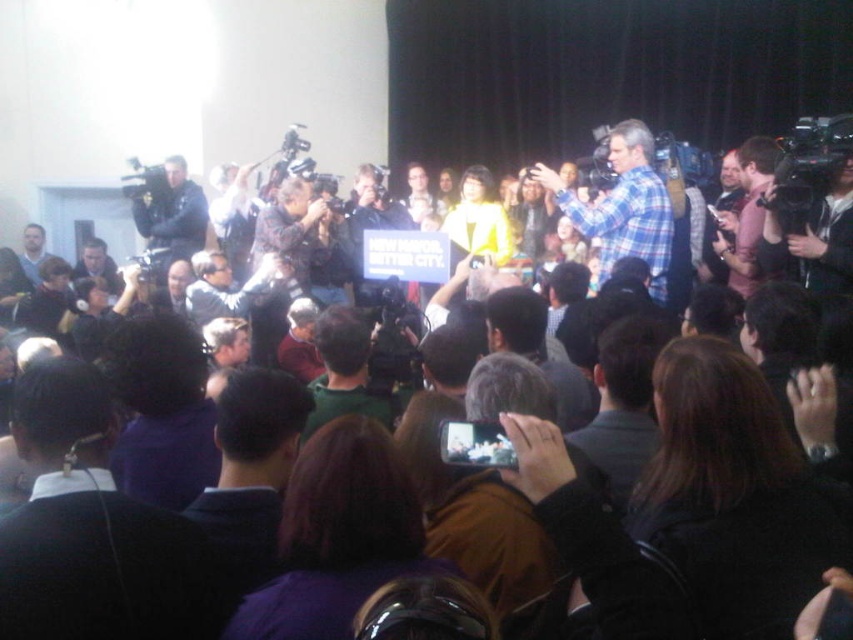
Describe the element at coordinates (91, 529) in the screenshot. I see `purple fabric at lower left` at that location.

Between purple fabric at lower left and purple fabric at center, which one appears on the left side from the viewer's perspective?

From the viewer's perspective, purple fabric at center appears more on the left side.

Is point (4, 592) positioned behind point (167, 424)?

No, it is not.

Locate an element on the screen. Image resolution: width=853 pixels, height=640 pixels. purple fabric at lower left is located at coordinates (91, 529).

Does dark brown hair at center lie in front of matte black headphones at left?

Yes, dark brown hair at center is closer to the viewer.

Who is higher up, dark brown hair at center or matte black headphones at left?

matte black headphones at left

Where is `dark brown hair at center`? This screenshot has width=853, height=640. dark brown hair at center is located at coordinates (735, 493).

Does purple fabric at center have a smaller size compared to green fabric shirt at center?

Indeed, purple fabric at center has a smaller size compared to green fabric shirt at center.

This screenshot has height=640, width=853. Find the location of `purple fabric at center`. purple fabric at center is located at coordinates (161, 410).